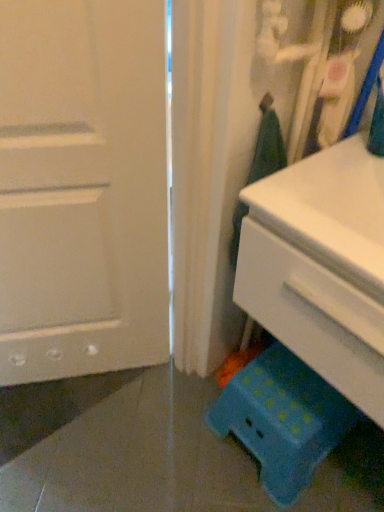
Question: Is white plastic chest of drawers at lower right spatially inside white matte door at left, or outside of it?

Choices:
 (A) inside
 (B) outside

Answer: (B)

Question: Considering the positions of white plastic chest of drawers at lower right and white matte door at left in the image, is white plastic chest of drawers at lower right taller or shorter than white matte door at left?

Choices:
 (A) short
 (B) tall

Answer: (A)

Question: Estimate the real-world distances between objects in this image. Which object is closer to the white plastic chest of drawers at lower right?

Choices:
 (A) blue polka dot plastic stool at lower right
 (B) white matte door at left
 (C) teal plastic stool at lower right

Answer: (C)

Question: Estimate the real-world distances between objects in this image. Which object is farther from the white plastic chest of drawers at lower right?

Choices:
 (A) teal plastic stool at lower right
 (B) blue polka dot plastic stool at lower right
 (C) white matte door at left

Answer: (B)